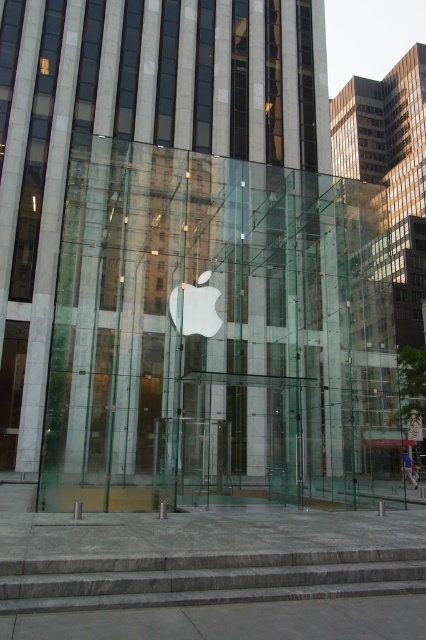
You are standing in front of the Apple Store and notice two points marked on the glass facade. The first point is at coordinates point (149, 502) and the second is at point (376, 570). Which point is closer to you?

Point (149, 502) is closer to you because it is further to the viewer than point (376, 570).

You are a delivery person trying to park your 2.5 meter wide truck in front of the transparent glass apple store at center. The gray stone stairs at lower center are in the way. Can you park your truck without overlapping the stairs?

The transparent glass apple store at center is wider than the gray stone stairs at lower center. Since the truck is 2.5 meters wide, it can park in front of the store as long as it stays within the store area, avoiding the narrower stairs.

In the scene shown: You are standing on the sidewalk in front of the transparent glass apple store at center and want to enter the building. The entrance is located at the bottom of the gray stone stairs at lower center. Do you need to look up or down to see the entrance?

The transparent glass apple store at center has a greater height compared to gray stone stairs at lower center, so you need to look down to see the entrance located at the bottom of the gray stone stairs at lower center.